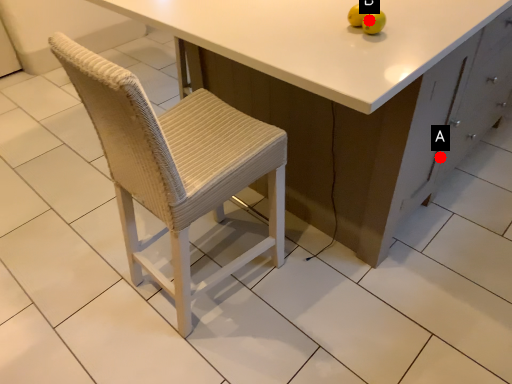
Question: Two points are circled on the image, labeled by A and B beside each circle. Which of the following is the farthest from the observer?

Choices:
 (A) A is further
 (B) B is further

Answer: (A)